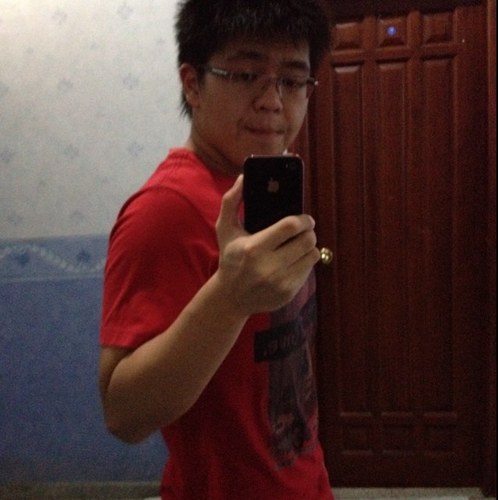
This screenshot has height=500, width=498. Find the location of `wall`. wall is located at coordinates (82, 151).